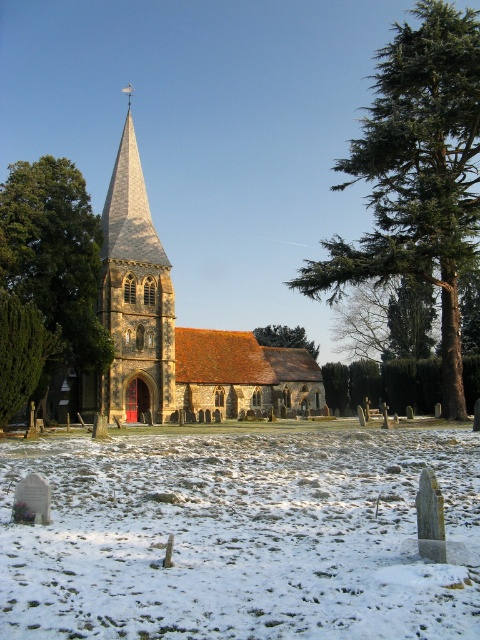
Question: Which of the following is the farthest from the observer?

Choices:
 (A) green textured tree at left
 (B) smooth stone spire at center
 (C) stone church at center

Answer: (C)

Question: Is smooth stone spire at center in front of green leafy tree at center?

Choices:
 (A) yes
 (B) no

Answer: (A)

Question: Which object is farther from the camera taking this photo?

Choices:
 (A) green textured tree at lower left
 (B) green leafy tree at center
 (C) green textured tree at left

Answer: (B)

Question: Is white powdery snow at center closer to camera compared to green leafy tree at center?

Choices:
 (A) yes
 (B) no

Answer: (A)

Question: Which of these objects is positioned farthest from the white powdery snow at center?

Choices:
 (A) smooth stone spire at center
 (B) stone church at center
 (C) green leafy tree at center

Answer: (C)

Question: Is green textured tree at right above green textured tree at lower left?

Choices:
 (A) yes
 (B) no

Answer: (A)